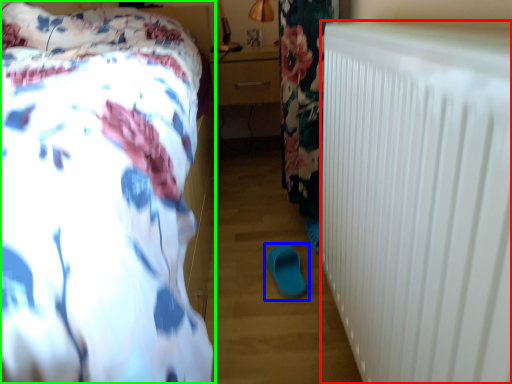
Question: Which object is the farthest from radiator (highlighted by a red box)? Choose among these: footwear (highlighted by a blue box) or bed (highlighted by a green box).

Choices:
 (A) footwear
 (B) bed

Answer: (A)